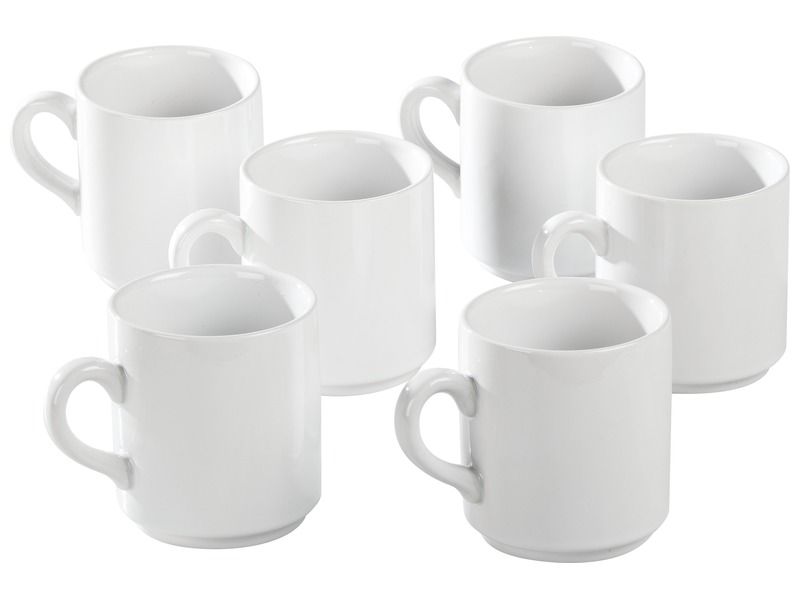
This screenshot has height=600, width=800. What are the coordinates of `mugs` in the screenshot? It's located at (170, 163), (202, 395), (340, 270), (600, 455), (710, 287), (528, 184).